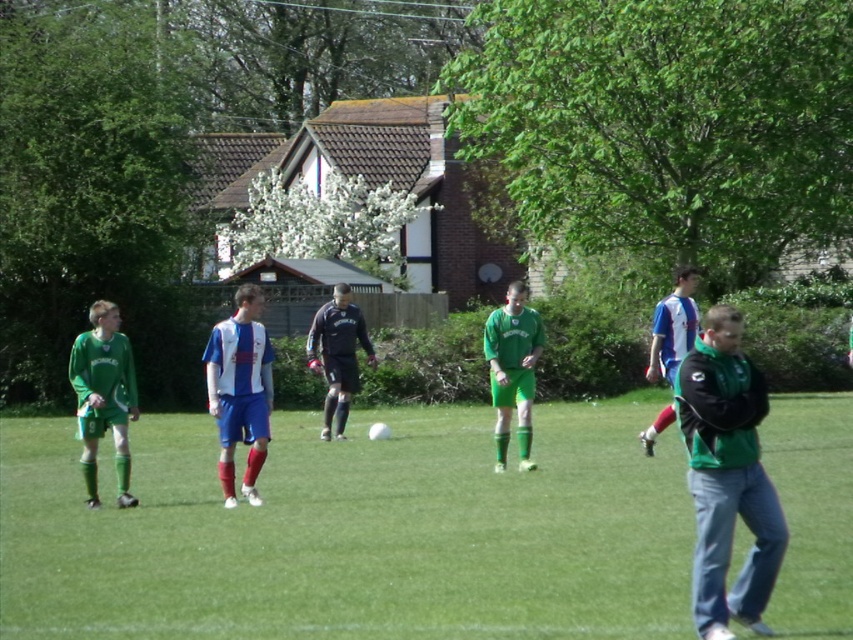
Question: Which point appears farthest from the camera in this image?

Choices:
 (A) (700, 589)
 (B) (233, 428)
 (C) (119, 563)

Answer: (B)

Question: Where is green matte soccer uniform at center located in relation to dark blue jersey at center in the image?

Choices:
 (A) below
 (B) above

Answer: (B)

Question: Which is farther from the dark blue jersey at center?

Choices:
 (A) green grass football field at center
 (B) white jersey at center

Answer: (B)

Question: Does green matte jersey at left lie in front of blue and white jersey at center?

Choices:
 (A) yes
 (B) no

Answer: (A)

Question: Does white jersey at center appear over green matte soccer uniform at center?

Choices:
 (A) no
 (B) yes

Answer: (A)

Question: Which object is the closest to the green matte jacket at lower right?

Choices:
 (A) green matte soccer uniform at center
 (B) green grass football field at center
 (C) green matte jersey at left
 (D) white jersey at center

Answer: (B)